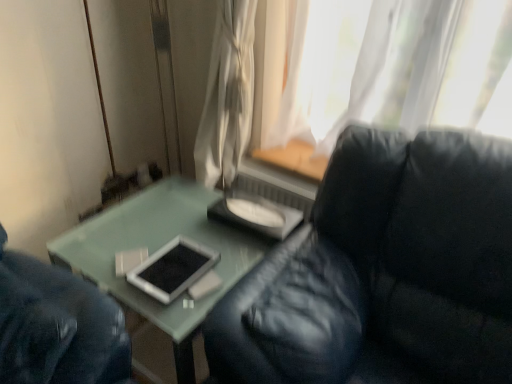
Question: Should I look upward or downward to see black leather couch at center?

Choices:
 (A) down
 (B) up

Answer: (A)

Question: From a real-world perspective, is black leather couch at center positioned over white sheer curtain at upper center based on gravity?

Choices:
 (A) yes
 (B) no

Answer: (B)

Question: Would you consider black leather couch at center to be distant from white sheer curtain at upper center?

Choices:
 (A) no
 (B) yes

Answer: (A)

Question: From the image's perspective, is black leather couch at center beneath white sheer curtain at upper center?

Choices:
 (A) no
 (B) yes

Answer: (B)

Question: Considering the relative sizes of black leather couch at center and white sheer curtain at upper center in the image provided, is black leather couch at center bigger than white sheer curtain at upper center?

Choices:
 (A) no
 (B) yes

Answer: (B)

Question: Is white sheer curtain at upper center inside black leather couch at center?

Choices:
 (A) no
 (B) yes

Answer: (A)

Question: Does black leather couch at center have a lesser width compared to white sheer curtain at upper center?

Choices:
 (A) yes
 (B) no

Answer: (B)

Question: Is white sheer curtain at upper center positioned with its back to black leather couch at center?

Choices:
 (A) no
 (B) yes

Answer: (A)

Question: Is white sheer curtain at upper center bigger than black leather couch at center?

Choices:
 (A) no
 (B) yes

Answer: (A)

Question: From the image's perspective, is white sheer curtain at upper center located above black leather couch at center?

Choices:
 (A) no
 (B) yes

Answer: (B)

Question: Is the position of white sheer curtain at upper center less distant than that of black leather couch at center?

Choices:
 (A) yes
 (B) no

Answer: (B)

Question: Can black leather couch at center be found inside white sheer curtain at upper center?

Choices:
 (A) no
 (B) yes

Answer: (A)

Question: From the image's perspective, is white sheer curtain at upper center below black leather couch at center?

Choices:
 (A) no
 (B) yes

Answer: (A)

Question: From a real-world perspective, relative to black leather couch at center, is white sheer curtain at upper center vertically above or below?

Choices:
 (A) above
 (B) below

Answer: (A)